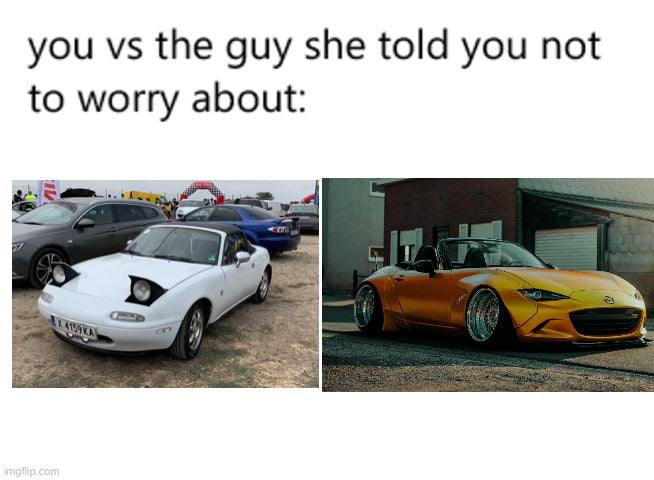
This screenshot has height=480, width=654. In order to click on seats in this screenshot , I will do `click(209, 248)`, `click(167, 242)`, `click(472, 261)`, `click(426, 256)`.